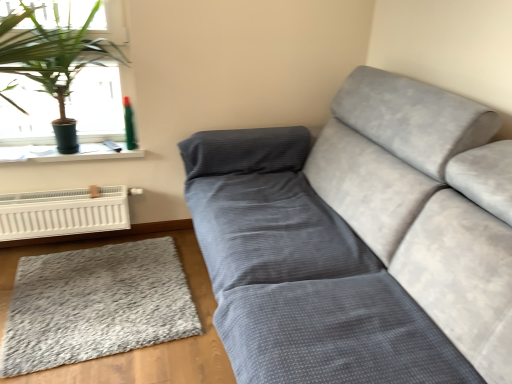
The height and width of the screenshot is (384, 512). What are the coordinates of `green leafy plant at upper left` in the screenshot? It's located at (66, 65).

Is white plastic heater at lower left aimed at teal plastic spray can at upper left?

No, white plastic heater at lower left does not turn towards teal plastic spray can at upper left.

Consider the image. Is white plastic heater at lower left beside teal plastic spray can at upper left?

No, white plastic heater at lower left is not with teal plastic spray can at upper left.

Which is in front, white plastic heater at lower left or teal plastic spray can at upper left?

white plastic heater at lower left is in front.

From the image's perspective, is white plastic heater at lower left on top of teal plastic spray can at upper left?

No, from the image's perspective, white plastic heater at lower left is not over teal plastic spray can at upper left.

Is teal plastic spray can at upper left wider than velvet gray couch at center?

Incorrect, the width of teal plastic spray can at upper left does not surpass that of velvet gray couch at center.

From the image's perspective, relative to velvet gray couch at center, is teal plastic spray can at upper left above or below?

From the image's perspective, teal plastic spray can at upper left appears above velvet gray couch at center.

Find the location of a particular element. This screenshot has height=384, width=512. studio couch below the teal plastic spray can at upper left (from a real-world perspective) is located at coordinates (360, 240).

Which of these two, teal plastic spray can at upper left or velvet gray couch at center, stands shorter?

With less height is teal plastic spray can at upper left.

Considering the sizes of green leafy plant at upper left and gray shaggy rug at lower left in the image, is green leafy plant at upper left taller or shorter than gray shaggy rug at lower left?

Considering their sizes, green leafy plant at upper left has more height than gray shaggy rug at lower left.

Is green leafy plant at upper left positioned with its back to gray shaggy rug at lower left?

That's not correct — green leafy plant at upper left is not looking away from gray shaggy rug at lower left.

Considering the positions of objects green leafy plant at upper left and gray shaggy rug at lower left in the image provided, who is more to the left, green leafy plant at upper left or gray shaggy rug at lower left?

green leafy plant at upper left.

From the picture: Can you confirm if green leafy plant at upper left is wider than gray shaggy rug at lower left?

In fact, green leafy plant at upper left might be narrower than gray shaggy rug at lower left.

Could teal plastic spray can at upper left be considered to be inside gray shaggy rug at lower left?

No, teal plastic spray can at upper left is not surrounded by gray shaggy rug at lower left.

From the image's perspective, is gray shaggy rug at lower left beneath teal plastic spray can at upper left?

Indeed, from the image's perspective, gray shaggy rug at lower left is shown beneath teal plastic spray can at upper left.

Who is more distant, gray shaggy rug at lower left or teal plastic spray can at upper left?

teal plastic spray can at upper left is behind.

Considering the sizes of gray shaggy rug at lower left and teal plastic spray can at upper left in the image, is gray shaggy rug at lower left bigger or smaller than teal plastic spray can at upper left?

gray shaggy rug at lower left is bigger than teal plastic spray can at upper left.

Is teal plastic spray can at upper left at the back of velvet gray couch at center?

No, velvet gray couch at center is not facing away from teal plastic spray can at upper left.

Which of these two, velvet gray couch at center or teal plastic spray can at upper left, stands shorter?

teal plastic spray can at upper left.

How far apart are velvet gray couch at center and teal plastic spray can at upper left?

velvet gray couch at center is 4.04 feet away from teal plastic spray can at upper left.

In the scene shown: Is white plastic window sill at upper left in front of or behind gray shaggy rug at lower left in the image?

white plastic window sill at upper left is positioned farther from the viewer than gray shaggy rug at lower left.

Where is `mat that is in front of the white plastic window sill at upper left`? This screenshot has width=512, height=384. mat that is in front of the white plastic window sill at upper left is located at coordinates (95, 305).

From a real-world perspective, is white plastic window sill at upper left located higher than gray shaggy rug at lower left?

Correct, in the physical world, white plastic window sill at upper left is higher than gray shaggy rug at lower left.

What's the angular difference between white plastic window sill at upper left and gray shaggy rug at lower left's facing directions?

There is a 86.5-degree angle between the facing directions of white plastic window sill at upper left and gray shaggy rug at lower left.

Who is bigger, velvet gray couch at center or green leafy plant at upper left?

velvet gray couch at center is bigger.

Is velvet gray couch at center at the left side of green leafy plant at upper left?

Incorrect, velvet gray couch at center is not on the left side of green leafy plant at upper left.

Find the location of a particular element. houseplant on the left of velvet gray couch at center is located at coordinates (66, 65).

Is velvet gray couch at center looking in the opposite direction of green leafy plant at upper left?

That's not correct — velvet gray couch at center is not looking away from green leafy plant at upper left.

This screenshot has height=384, width=512. Identify the location of heater below the teal plastic spray can at upper left (from the image's perspective). (63, 213).

Identify the location of teal behind the velvet gray couch at center. (129, 124).

Looking at the image, which one is located closer to green leafy plant at upper left, white plastic window sill at upper left or velvet gray couch at center?

Based on the image, white plastic window sill at upper left appears to be nearer to green leafy plant at upper left.

Considering their positions, is white plastic window sill at upper left positioned closer to white plastic heater at lower left than teal plastic spray can at upper left?

white plastic window sill at upper left is positioned closer to the anchor white plastic heater at lower left.

From the image, which object appears to be nearer to teal plastic spray can at upper left, gray shaggy rug at lower left or velvet gray couch at center?

gray shaggy rug at lower left is closer to teal plastic spray can at upper left.

Based on the photo, looking at the image, which one is located further to velvet gray couch at center, teal plastic spray can at upper left or white plastic window sill at upper left?

Among the two, teal plastic spray can at upper left is located further to velvet gray couch at center.

Looking at the image, which one is located further to green leafy plant at upper left, teal plastic spray can at upper left or gray shaggy rug at lower left?

gray shaggy rug at lower left lies further to green leafy plant at upper left than the other object.

From the image, which object appears to be farther from gray shaggy rug at lower left, teal plastic spray can at upper left or velvet gray couch at center?

teal plastic spray can at upper left.

Looking at the image, which one is located further to velvet gray couch at center, teal plastic spray can at upper left or white plastic heater at lower left?

Among the two, teal plastic spray can at upper left is located further to velvet gray couch at center.

Based on the photo, from the image, which object appears to be farther from teal plastic spray can at upper left, white plastic heater at lower left or green leafy plant at upper left?

The object further to teal plastic spray can at upper left is white plastic heater at lower left.

The height and width of the screenshot is (384, 512). In order to click on houseplant between velvet gray couch at center and teal plastic spray can at upper left from front to back in this screenshot , I will do `click(66, 65)`.

Find the location of a particular element. mat between velvet gray couch at center and green leafy plant at upper left from front to back is located at coordinates (95, 305).

You are a GUI agent. You are given a task and a screenshot of the screen. Output one action in this format:
    pyautogui.click(x=<x>, y=<y>)
    Task: Click on the heater between white plastic window sill at upper left and gray shaggy rug at lower left in the vertical direction
    
    Given the screenshot: What is the action you would take?
    pyautogui.click(x=63, y=213)

This screenshot has height=384, width=512. Identify the location of heater that lies between green leafy plant at upper left and gray shaggy rug at lower left from top to bottom. (63, 213).